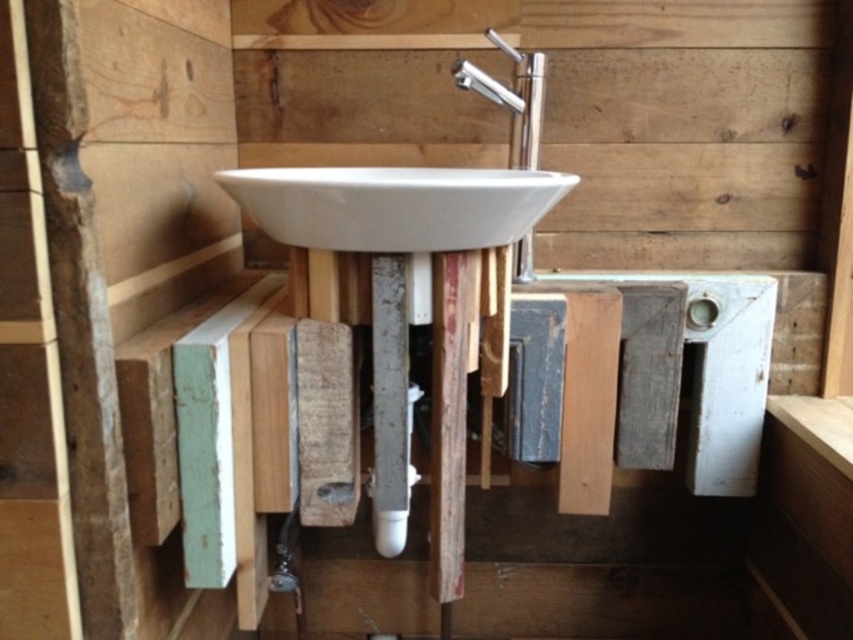
Question: Can you confirm if white glossy sink at center is bigger than silver metallic faucet at upper center?

Choices:
 (A) no
 (B) yes

Answer: (B)

Question: From the image, what is the correct spatial relationship of white glossy sink at center in relation to silver metallic faucet at upper center?

Choices:
 (A) right
 (B) left

Answer: (B)

Question: Does white glossy sink at center appear on the left side of silver metallic faucet at upper center?

Choices:
 (A) no
 (B) yes

Answer: (B)

Question: Among these points, which one is nearest to the camera?

Choices:
 (A) (526, 106)
 (B) (456, 198)

Answer: (B)